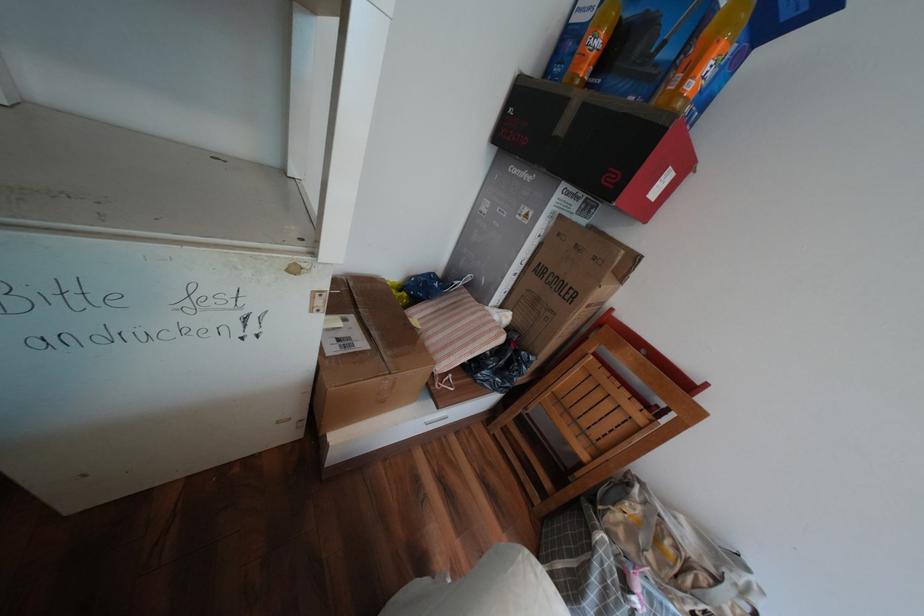
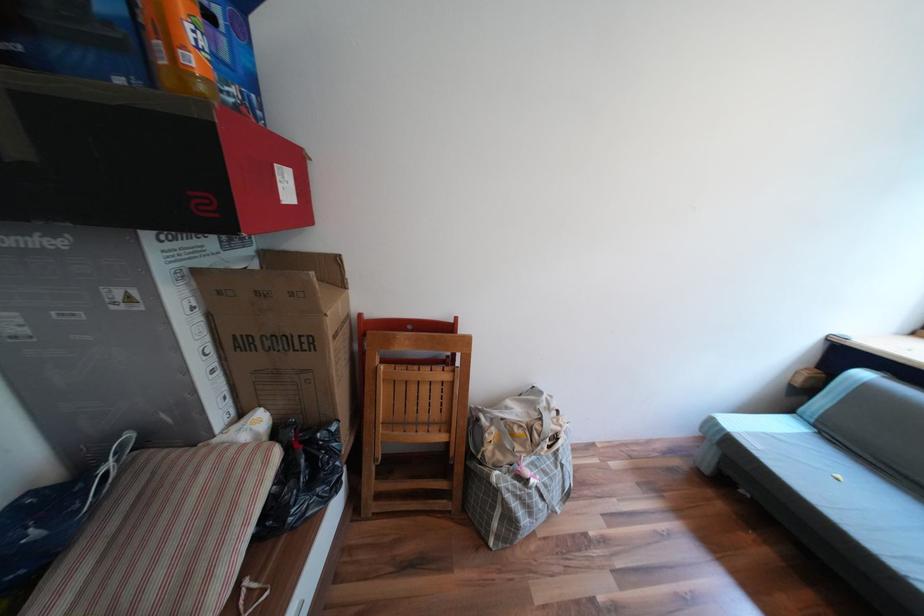
The point at (699, 87) is marked in the first image. Where is the corresponding point in the second image?

(201, 61)